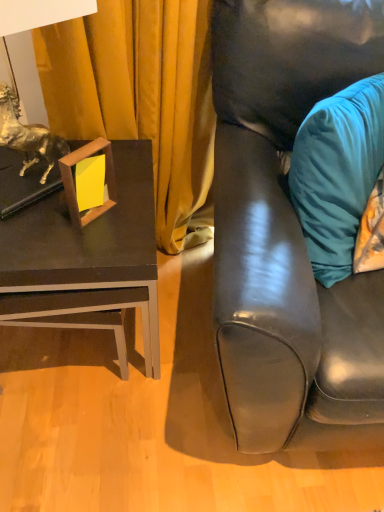
Question: From the image's perspective, is woodenobject at left located above or below matte black table at left?

Choices:
 (A) above
 (B) below

Answer: (A)

Question: Would you say woodenobject at left is to the left or to the right of matte black table at left in the picture?

Choices:
 (A) left
 (B) right

Answer: (B)

Question: Which object is the farthest from the woodenobject at left?

Choices:
 (A) matte black couch at right
 (B) matte black table at left
 (C) teal velvet pillow at right

Answer: (C)

Question: Based on their relative distances, which object is farther from the matte black couch at right?

Choices:
 (A) teal velvet pillow at right
 (B) woodenobject at left
 (C) matte black table at left

Answer: (B)